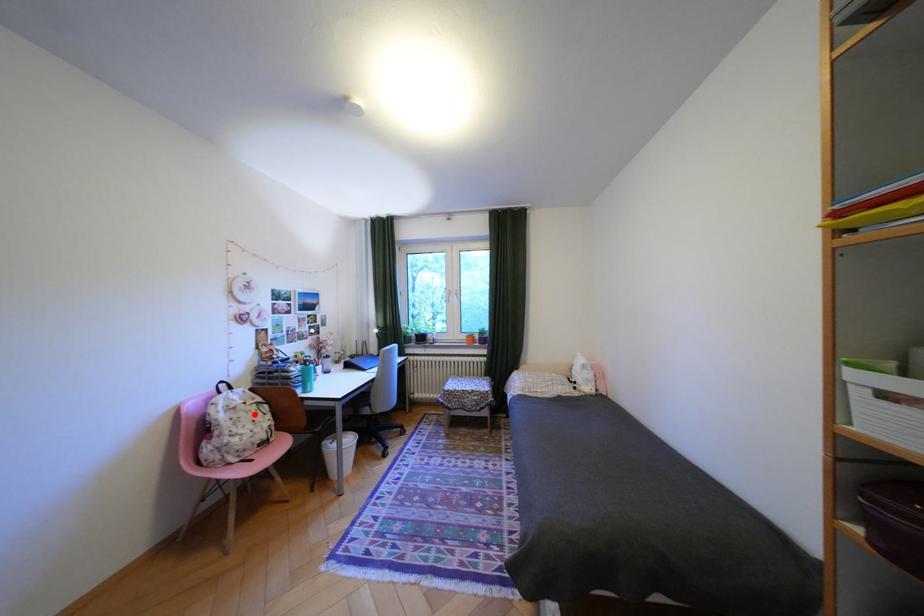
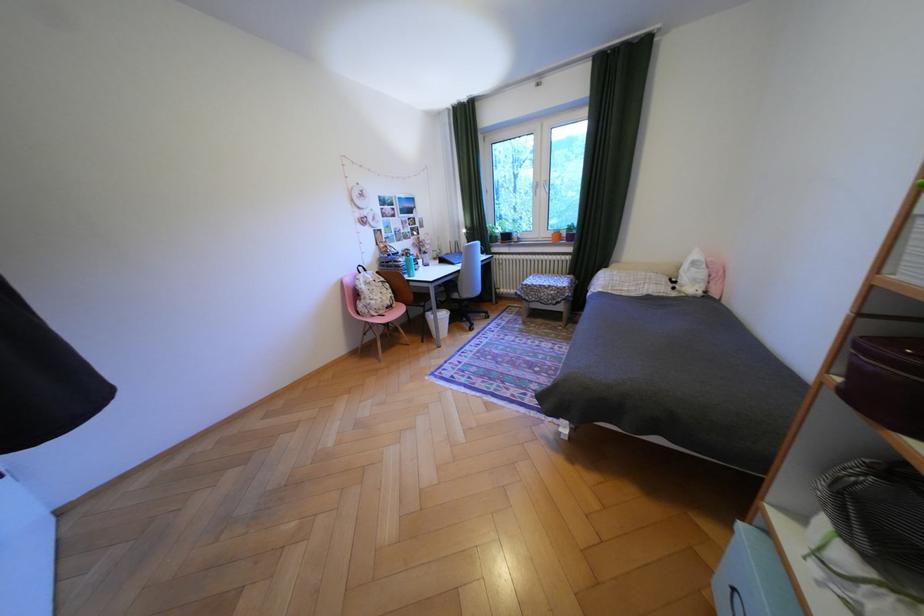
The point at the highlighted location is marked in the first image. Where is the corresponding point in the second image?

(386, 288)